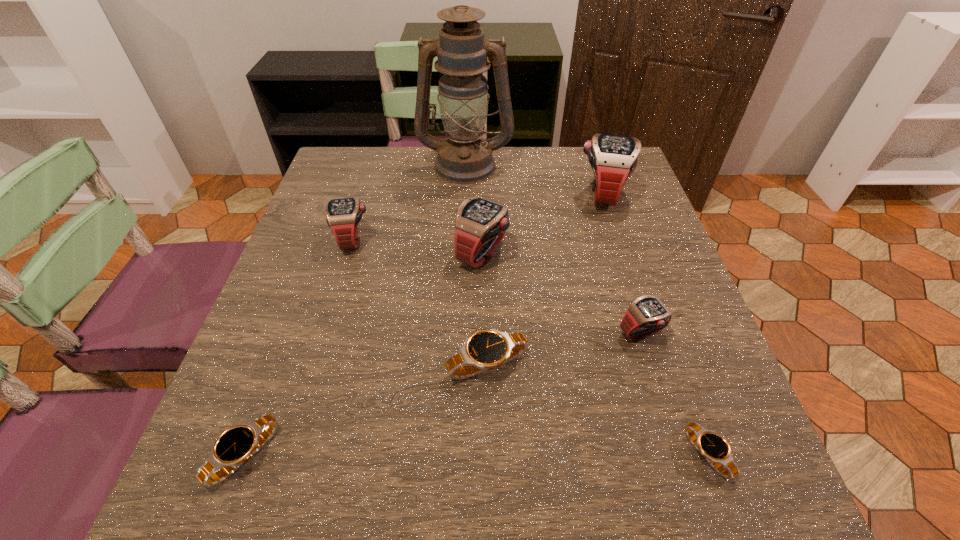
Find the location of a particular element. the biggest black watch is located at coordinates (485, 349).

Locate an element on the screen. the sixth tallest object is located at coordinates (485, 349).

Identify the location of the seventh tallest object. (235, 446).

Where is `the second shortest watch`? The width and height of the screenshot is (960, 540). the second shortest watch is located at coordinates (235, 446).

At what (x,y) coordinates should I click in order to perform the action: click on the rightmost black watch. Please return your answer as a coordinate pair (x, y). This screenshot has height=540, width=960. Looking at the image, I should click on (713, 447).

Where is `the shortest object`? the shortest object is located at coordinates (713, 447).

Where is `vacant space located on the right of the brown oil lamp`? The height and width of the screenshot is (540, 960). vacant space located on the right of the brown oil lamp is located at coordinates (575, 164).

This screenshot has height=540, width=960. I want to click on free spot located on the left of the farthest watch, so click(x=492, y=194).

At what (x,y) coordinates should I click in order to perform the action: click on free space located on the left of the sixth shortest watch. Please return your answer as a coordinate pair (x, y). Image resolution: width=960 pixels, height=540 pixels. Looking at the image, I should click on (323, 253).

At what (x,y) coordinates should I click in order to perform the action: click on free space located 0.350m on the back of the third biggest red watch. Please return your answer as a coordinate pair (x, y). The image size is (960, 540). Looking at the image, I should click on (380, 148).